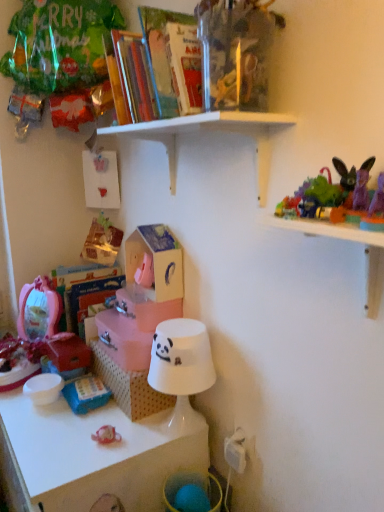
The image size is (384, 512). In order to click on vacant region in front of white cardboard box at center in this screenshot , I will do `click(90, 438)`.